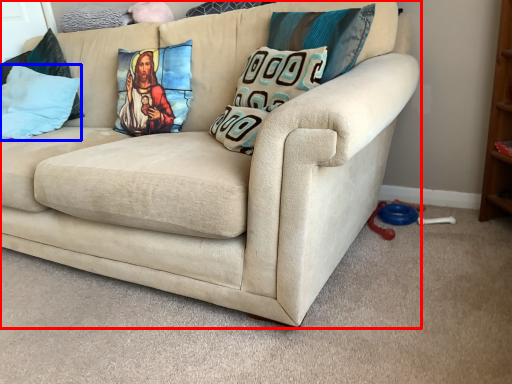
Question: Among these objects, which one is nearest to the camera, studio couch (highlighted by a red box) or pillow (highlighted by a blue box)?

Choices:
 (A) studio couch
 (B) pillow

Answer: (A)